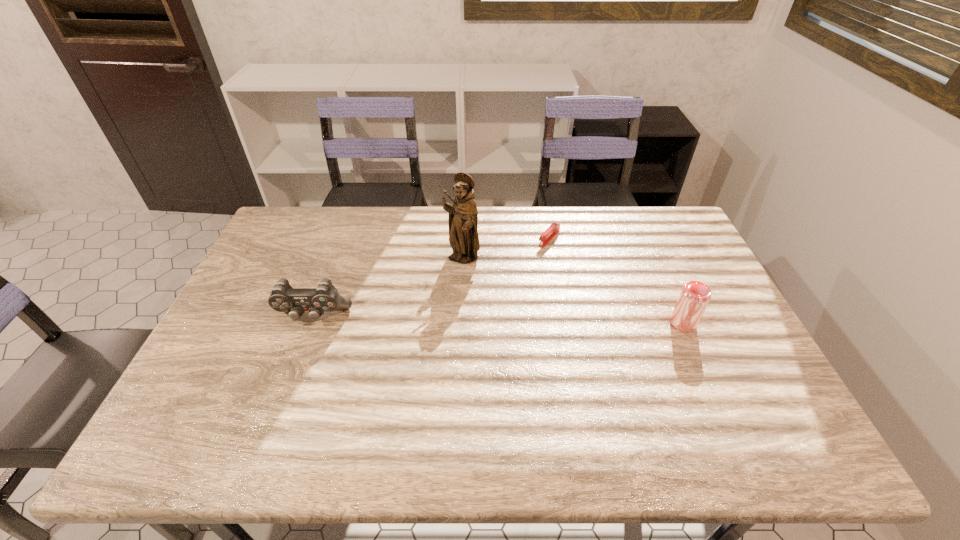
This screenshot has width=960, height=540. I want to click on vacant space at the right edge of the desktop, so click(724, 364).

This screenshot has width=960, height=540. In order to click on free space at the far left corner in this screenshot , I will do `click(324, 210)`.

This screenshot has width=960, height=540. In the image, there is a desktop. Identify the location of vacant space at the far right corner. (633, 214).

Locate an element on the screen. vacant space that's between the control and the rightmost object is located at coordinates (498, 320).

This screenshot has height=540, width=960. Identify the location of free space between the tallest object and the stapler. (506, 249).

Where is `blank region between the control and the stapler`? The image size is (960, 540). blank region between the control and the stapler is located at coordinates (431, 278).

Find the location of a particular element. free space between the figurine and the control is located at coordinates (388, 288).

Identify the location of empty location between the shortest object and the leftmost object. This screenshot has width=960, height=540. (431, 278).

Where is `unoccupied position between the stapler and the leftmost object`? unoccupied position between the stapler and the leftmost object is located at coordinates (431, 278).

Locate an element on the screen. vacant point located between the rightmost object and the leftmost object is located at coordinates (498, 320).